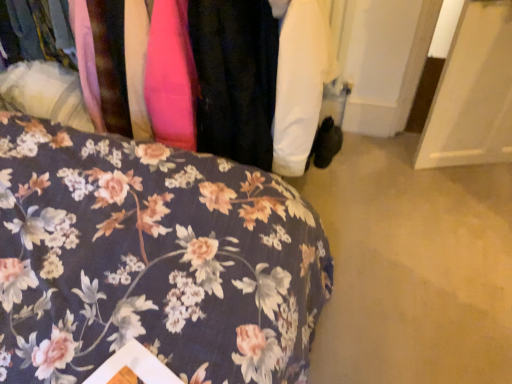
The image size is (512, 384). Identify the location of floral fabric at center. (236, 82).

What is the approximate width of floral fabric at center?

It is 28.00 inches.

The image size is (512, 384). Describe the element at coordinates (236, 82) in the screenshot. I see `floral fabric at center` at that location.

Describe the element at coordinates (151, 260) in the screenshot. I see `floral fabric bedspread at lower left` at that location.

This screenshot has width=512, height=384. I want to click on floral fabric bedspread at lower left, so click(x=151, y=260).

Identify the location of floral fabric at center. tap(236, 82).

Considering the positions of objects floral fabric bedspread at lower left and floral fabric at center in the image provided, who is more to the left, floral fabric bedspread at lower left or floral fabric at center?

From the viewer's perspective, floral fabric bedspread at lower left appears more on the left side.

Which is behind, floral fabric bedspread at lower left or floral fabric at center?

floral fabric at center is more distant.

Considering the positions of point (321, 308) and point (89, 110), is point (321, 308) closer or farther from the camera than point (89, 110)?

Point (321, 308).

Looking at this image, from the image's perspective, who appears lower, floral fabric bedspread at lower left or floral fabric at center?

floral fabric bedspread at lower left.

From a real-world perspective, is floral fabric bedspread at lower left physically above floral fabric at center?

No, from a real-world perspective, floral fabric bedspread at lower left is not on top of floral fabric at center.

Can you confirm if floral fabric bedspread at lower left is wider than floral fabric at center?

Yes, floral fabric bedspread at lower left is wider than floral fabric at center.

Considering the sizes of objects floral fabric bedspread at lower left and floral fabric at center in the image provided, who is shorter, floral fabric bedspread at lower left or floral fabric at center?

Standing shorter between the two is floral fabric at center.

Between floral fabric bedspread at lower left and floral fabric at center, which one has smaller size?

With smaller size is floral fabric at center.

Is floral fabric at center located within floral fabric bedspread at lower left?

No, floral fabric at center is located outside of floral fabric bedspread at lower left.

In the scene shown: Is floral fabric bedspread at lower left far away from floral fabric at center?

No, floral fabric bedspread at lower left is not far away from floral fabric at center.

Is floral fabric bedspread at lower left positioned with its back to floral fabric at center?

floral fabric bedspread at lower left is not turned away from floral fabric at center.

What's the angular difference between floral fabric bedspread at lower left and floral fabric at center's facing directions?

The angular difference between floral fabric bedspread at lower left and floral fabric at center is 177 degrees.

From the picture: How much distance is there between floral fabric bedspread at lower left and floral fabric at center?

15.17 inches.

Find the location of a particular element. closet on the right of floral fabric bedspread at lower left is located at coordinates (236, 82).

Considering the relative positions of floral fabric at center and floral fabric bedspread at lower left in the image provided, is floral fabric at center to the right of floral fabric bedspread at lower left from the viewer's perspective?

Correct, you'll find floral fabric at center to the right of floral fabric bedspread at lower left.

Which object is more forward, floral fabric at center or floral fabric bedspread at lower left?

Positioned in front is floral fabric bedspread at lower left.

Which point is more forward, [196,92] or [151,233]?

The point [151,233] is in front.

From the image's perspective, which one is positioned higher, floral fabric at center or floral fabric bedspread at lower left?

floral fabric at center.

From a real-world perspective, is floral fabric at center beneath floral fabric bedspread at lower left?

No, from a real-world perspective, floral fabric at center is not under floral fabric bedspread at lower left.

Does floral fabric at center have a greater width compared to floral fabric bedspread at lower left?

In fact, floral fabric at center might be narrower than floral fabric bedspread at lower left.

Between floral fabric at center and floral fabric bedspread at lower left, which one has less height?

With less height is floral fabric at center.

Between floral fabric at center and floral fabric bedspread at lower left, which one has larger size?

floral fabric bedspread at lower left is bigger.

Would you say floral fabric at center contains floral fabric bedspread at lower left?

No, floral fabric bedspread at lower left is not inside floral fabric at center.

Is floral fabric at center far away from floral fabric bedspread at lower left?

No, there isn't a large distance between floral fabric at center and floral fabric bedspread at lower left.

Is floral fabric bedspread at lower left at the back of floral fabric at center?

No, floral fabric at center's orientation is not away from floral fabric bedspread at lower left.

What's the angular difference between floral fabric at center and floral fabric bedspread at lower left's facing directions?

177 degrees.

At what (x,y) coordinates should I click in order to perform the action: click on closet behind the floral fabric bedspread at lower left. Please return your answer as a coordinate pair (x, y). Image resolution: width=512 pixels, height=384 pixels. Looking at the image, I should click on (236, 82).

The width and height of the screenshot is (512, 384). In order to click on furniture below the floral fabric at center (from a real-world perspective) in this screenshot , I will do `click(151, 260)`.

Where is `closet on the right of floral fabric bedspread at lower left`? Image resolution: width=512 pixels, height=384 pixels. closet on the right of floral fabric bedspread at lower left is located at coordinates (236, 82).